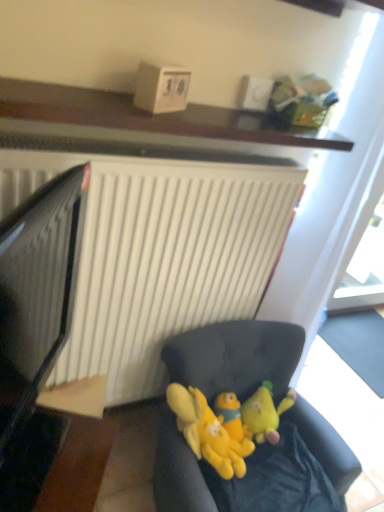
Question: From their relative heights in the image, would you say wooden shelf at upper center is taller or shorter than yellow plush toys at center, placed as the 1th toy when sorted from left to right?

Choices:
 (A) tall
 (B) short

Answer: (B)

Question: Based on their positions, is wooden shelf at upper center located to the left or right of yellow plush toys at center, positioned as the 3th toy in right-to-left order?

Choices:
 (A) right
 (B) left

Answer: (B)

Question: Which object is the farthest from the black glossy computer monitor at left?

Choices:
 (A) yellow plush toy at center, the third toy viewed from the left
 (B) wooden table at lower left
 (C) yellow plush toy at center, the second toy viewed from the right
 (D) wooden shelf at upper center
 (E) yellow plush toys at center, positioned as the 3th toy in right-to-left order

Answer: (A)

Question: Which is farther from the yellow plush toy at center, the third toy viewed from the left?

Choices:
 (A) yellow plush toy at center, the second toy viewed from the right
 (B) wooden shelf at upper center
 (C) black glossy computer monitor at left
 (D) soft fabric couch at lower center
 (E) yellow plush toys at center, positioned as the 3th toy in right-to-left order

Answer: (B)